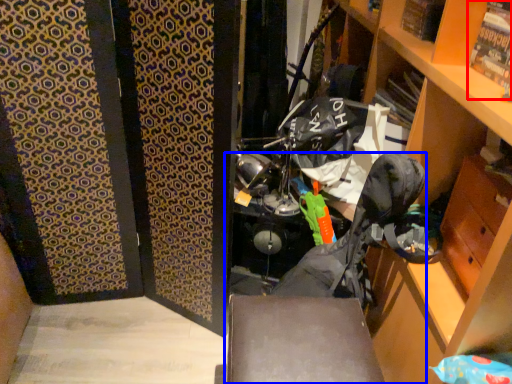
Question: Which object is closer to the camera taking this photo, magazine (highlighted by a red box) or folding chair (highlighted by a blue box)?

Choices:
 (A) magazine
 (B) folding chair

Answer: (A)